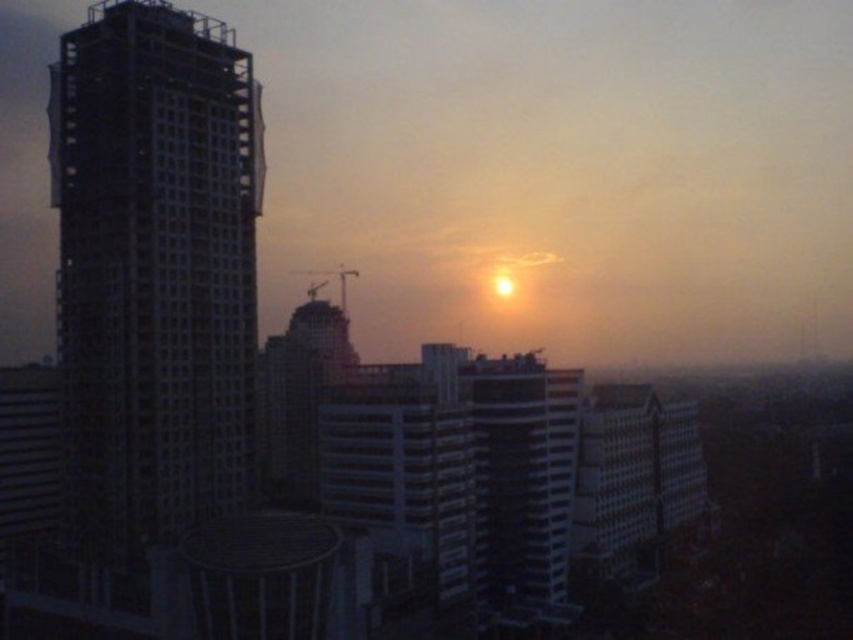
Is metallic grid tower at left to the left of smooth glass building at center from the viewer's perspective?

Indeed, metallic grid tower at left is positioned on the left side of smooth glass building at center.

Describe the element at coordinates (155, 273) in the screenshot. This screenshot has height=640, width=853. I see `metallic grid tower at left` at that location.

Locate an element on the screen. The width and height of the screenshot is (853, 640). metallic grid tower at left is located at coordinates (155, 273).